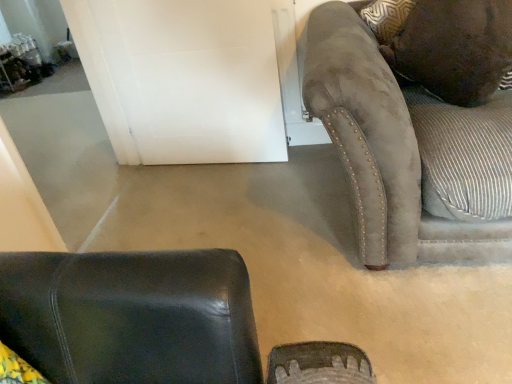
What is the approximate height of brown suede pillow at upper right?

45.51 centimeters.

What do you see at coordinates (394, 145) in the screenshot?
I see `suede couch at right` at bounding box center [394, 145].

Find the location of `brown suede pillow at upper right`. brown suede pillow at upper right is located at coordinates (446, 44).

Considering the positions of point (163, 24) and point (367, 38), is point (163, 24) closer or farther from the camera than point (367, 38)?

Point (163, 24) appears to be farther away from the viewer than point (367, 38).

Based on the photo, considering the positions of objects white matte door at upper center and suede couch at right in the image provided, who is in front, white matte door at upper center or suede couch at right?

Positioned in front is suede couch at right.

Can you confirm if white matte door at upper center is smaller than suede couch at right?

Indeed, white matte door at upper center has a smaller size compared to suede couch at right.

Is suede couch at right positioned with its back to brown suede pillow at upper right?

Yes, brown suede pillow at upper right is at the back of suede couch at right.

Where is `pillow above the suede couch at right (from the image's perspective)`? The height and width of the screenshot is (384, 512). pillow above the suede couch at right (from the image's perspective) is located at coordinates (446, 44).

Does suede couch at right have a smaller size compared to brown suede pillow at upper right?

Incorrect, suede couch at right is not smaller in size than brown suede pillow at upper right.

Is suede couch at right wider or thinner than brown suede pillow at upper right?

In the image, suede couch at right appears to be wider than brown suede pillow at upper right.

Considering the positions of objects brown suede pillow at upper right and suede couch at right in the image provided, who is more to the left, brown suede pillow at upper right or suede couch at right?

From the viewer's perspective, brown suede pillow at upper right appears more on the left side.

Is brown suede pillow at upper right touching suede couch at right?

There is a gap between brown suede pillow at upper right and suede couch at right.

Consider the image. Considering the positions of objects brown suede pillow at upper right and suede couch at right in the image provided, who is in front, brown suede pillow at upper right or suede couch at right?

suede couch at right.

How many degrees apart are the facing directions of white matte door at upper center and brown suede pillow at upper right?

The angular difference between white matte door at upper center and brown suede pillow at upper right is 2.3 degrees.

Is brown suede pillow at upper right at the back of white matte door at upper center?

No.

Is white matte door at upper center taller than brown suede pillow at upper right?

Yes.

Which is more to the left, white matte door at upper center or brown suede pillow at upper right?

Positioned to the left is white matte door at upper center.

In the scene shown: Can white matte door at upper center be found inside suede couch at right?

No.

Is suede couch at right turned away from white matte door at upper center?

No, suede couch at right's orientation is not away from white matte door at upper center.

Locate an element on the screen. The height and width of the screenshot is (384, 512). door positioned vertically above the suede couch at right (from a real-world perspective) is located at coordinates (194, 78).

Looking at this image, is brown suede pillow at upper right thinner than white matte door at upper center?

No, brown suede pillow at upper right is not thinner than white matte door at upper center.

Between brown suede pillow at upper right and white matte door at upper center, which one has smaller size?

With smaller size is white matte door at upper center.

Based on the photo, from a real-world perspective, who is located lower, brown suede pillow at upper right or white matte door at upper center?

white matte door at upper center, from a real-world perspective.

Who is more distant, brown suede pillow at upper right or white matte door at upper center?

white matte door at upper center is behind.

The width and height of the screenshot is (512, 384). In order to click on door located on the left of suede couch at right in this screenshot , I will do `click(194, 78)`.

This screenshot has width=512, height=384. What are the coordinates of `studio couch that is in front of the brown suede pillow at upper right` in the screenshot? It's located at (394, 145).

When comparing their distances from suede couch at right, does white matte door at upper center or brown suede pillow at upper right seem further?

white matte door at upper center.

Looking at the image, which one is located closer to white matte door at upper center, brown suede pillow at upper right or suede couch at right?

Among the two, suede couch at right is located nearer to white matte door at upper center.

Estimate the real-world distances between objects in this image. Which object is closer to brown suede pillow at upper right, white matte door at upper center or suede couch at right?

suede couch at right is positioned closer to the anchor brown suede pillow at upper right.

When comparing their distances from white matte door at upper center, does suede couch at right or brown suede pillow at upper right seem further?

Among the two, brown suede pillow at upper right is located further to white matte door at upper center.

Considering their positions, is suede couch at right positioned further to brown suede pillow at upper right than white matte door at upper center?

white matte door at upper center.

From the image, which object appears to be nearer to suede couch at right, brown suede pillow at upper right or white matte door at upper center?

brown suede pillow at upper right lies closer to suede couch at right than the other object.

Locate an element on the screen. The height and width of the screenshot is (384, 512). pillow between white matte door at upper center and suede couch at right is located at coordinates (446, 44).